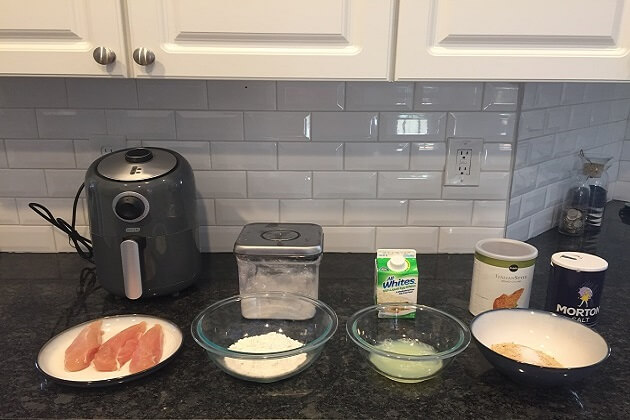
Find the location of a particular element. This screenshot has height=420, width=630. outlet is located at coordinates (450, 160).